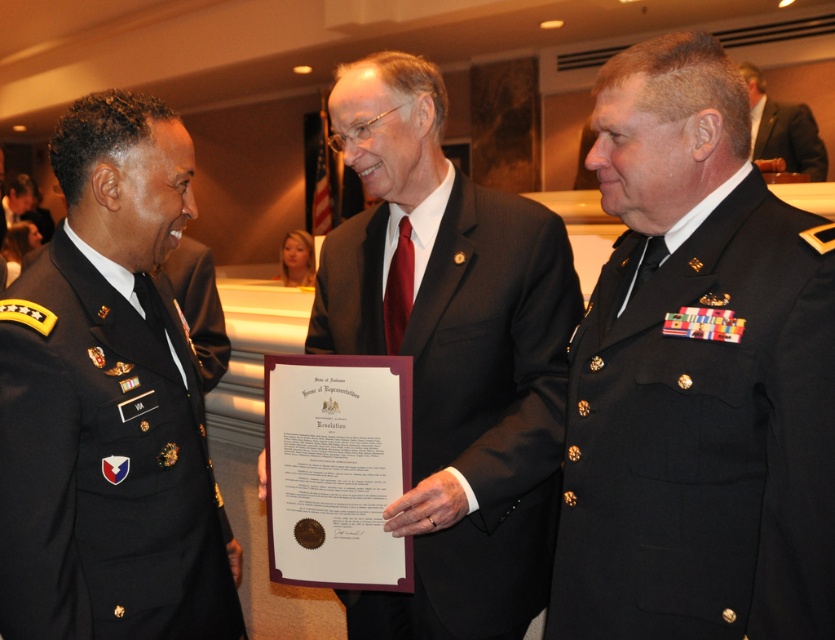
Which is behind, point (777, 496) or point (520, 557)?

The point (520, 557) is more distant.

Is the position of black matte uniform at center more distant than that of black matte suit at center?

No.

Between point (654, 584) and point (309, 324), which one is positioned behind?

The point (309, 324) is behind.

Where is `black matte uniform at center`? This screenshot has width=835, height=640. black matte uniform at center is located at coordinates (702, 435).

Can you confirm if black matte uniform at center is positioned below dark suit at center?

Yes, black matte uniform at center is below dark suit at center.

Does black matte uniform at center come in front of dark suit at center?

Yes, it is.

Which is in front, point (810, 259) or point (805, 148)?

Point (810, 259) is in front.

At what (x,y) coordinates should I click in order to perform the action: click on black matte uniform at center. Please return your answer as a coordinate pair (x, y). Looking at the image, I should click on (702, 435).

Does black matte suit at center have a greater width compared to dark suit at center?

Yes.

Between black matte suit at center and dark suit at center, which one has more height?

Standing taller between the two is black matte suit at center.

Who is more forward, (x=488, y=500) or (x=816, y=154)?

Point (x=488, y=500) is in front.

Identify the location of black matte suit at center. The image size is (835, 640). (484, 417).